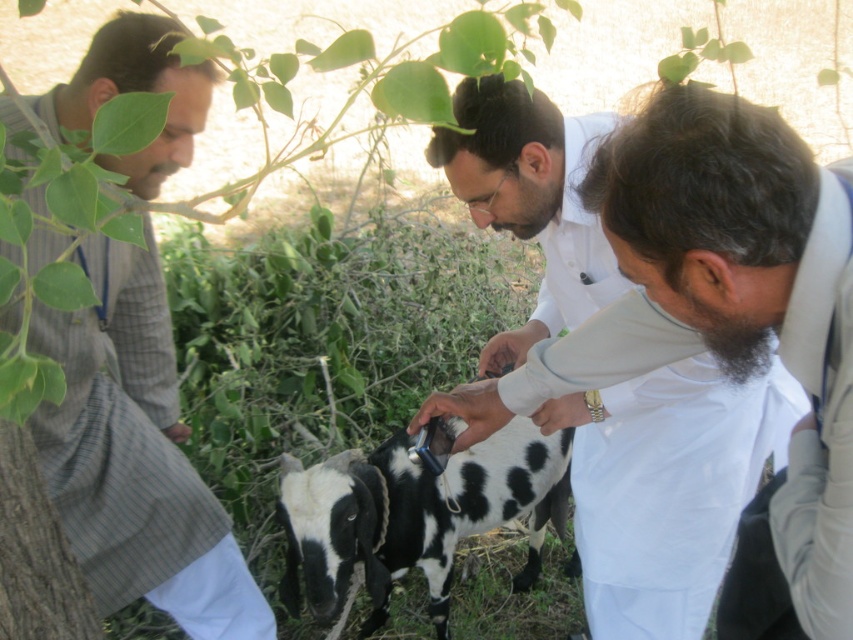
Is green leafy tree at upper left behind striped fabric shirt at left?

No, it is in front of striped fabric shirt at left.

Who is taller, green leafy tree at upper left or striped fabric shirt at left?

striped fabric shirt at left

Is point (134, 202) positioned in front of point (148, 424)?

Yes, point (134, 202) is closer to viewer.

Locate an element on the screen. The height and width of the screenshot is (640, 853). green leafy tree at upper left is located at coordinates (119, 292).

Is point (164, 484) closer to camera compared to point (469, 529)?

Yes, it is.

Is striped fabric shirt at left thinner than black and white spotted goat at center?

Correct, striped fabric shirt at left's width is less than black and white spotted goat at center's.

Identify the location of striped fabric shirt at left. Image resolution: width=853 pixels, height=640 pixels. (135, 456).

Does white shirt at center appear under striped fabric shirt at left?

No.

Who is more distant from viewer, (604, 547) or (91, 563)?

The point (604, 547) is more distant.

What are the coordinates of `white shirt at center` in the screenshot? It's located at (666, 486).